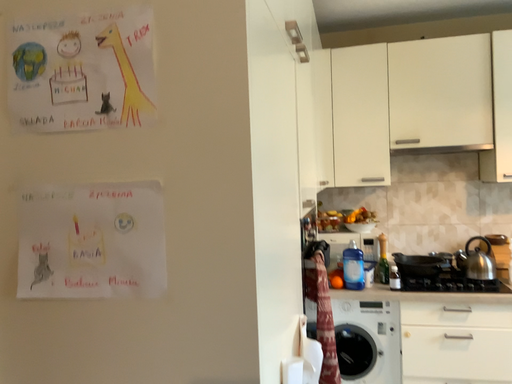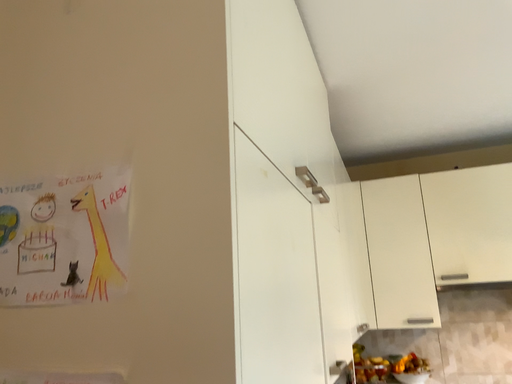
Question: How did the camera likely rotate when shooting the video?

Choices:
 (A) rotated downward
 (B) rotated upward

Answer: (B)